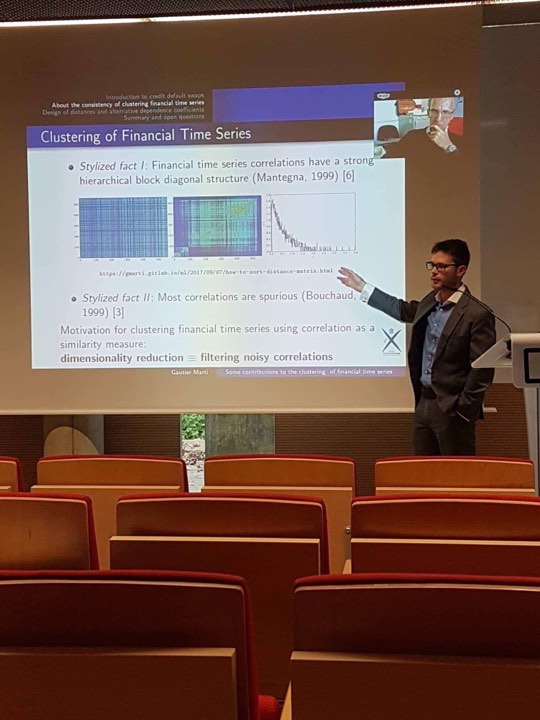
Where is `window`? The image size is (540, 720). window is located at coordinates (189, 425).